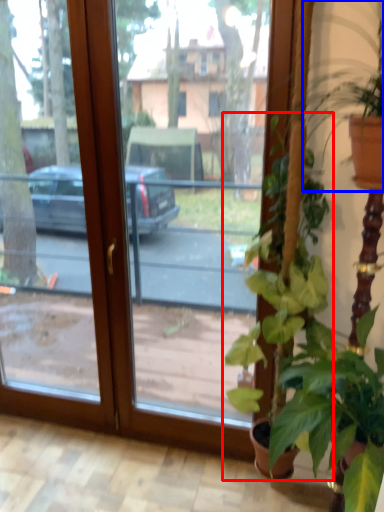
Question: Which object is closer to the camera taking this photo, houseplant (highlighted by a red box) or houseplant (highlighted by a blue box)?

Choices:
 (A) houseplant
 (B) houseplant

Answer: (B)